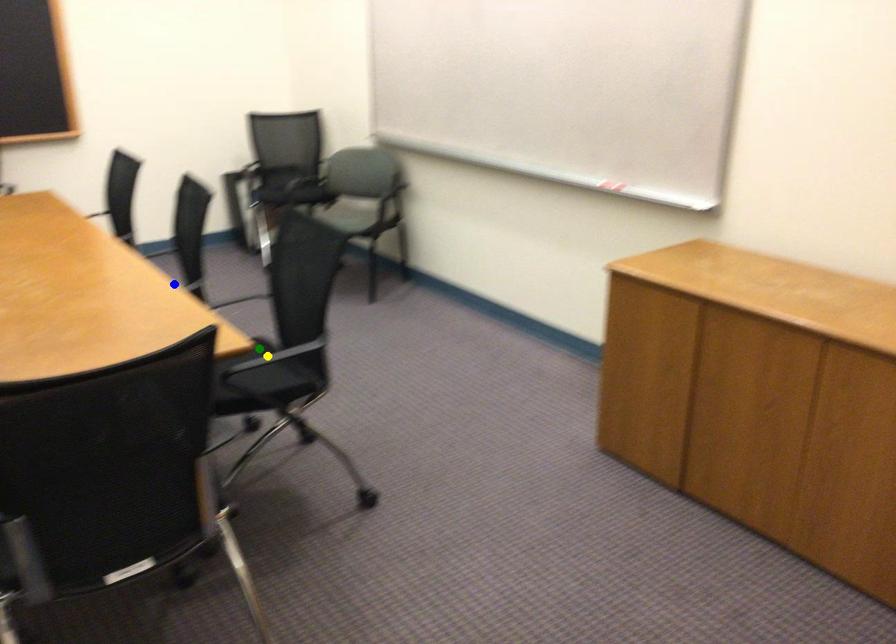
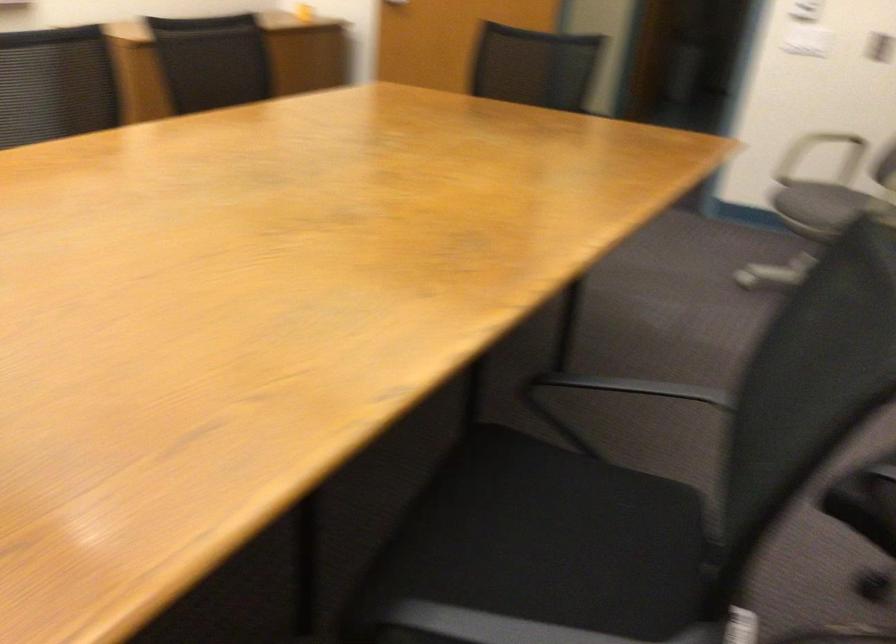
I am providing you with two images of the same scene from different viewpoints. Three points are marked in image1. Which point corresponds to a part or object that is occluded in image2?In image1, three points are marked. Which of them correspond to a part or object that is occluded in image2?Among the three points shown in image1, which one corresponds to a part or object that is no longer visible due to occlusion in image2?

Invisible in image2: yellow point, green point, blue point.